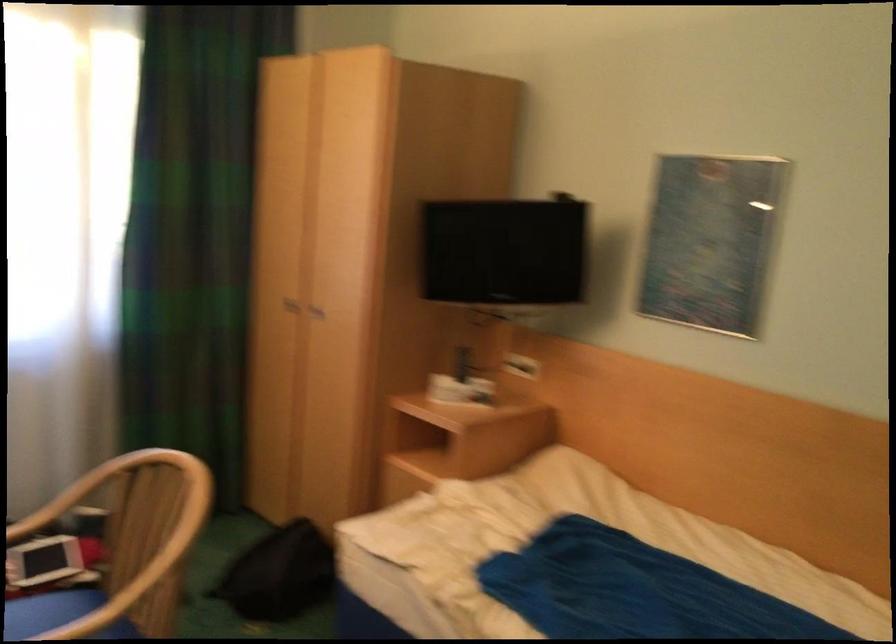
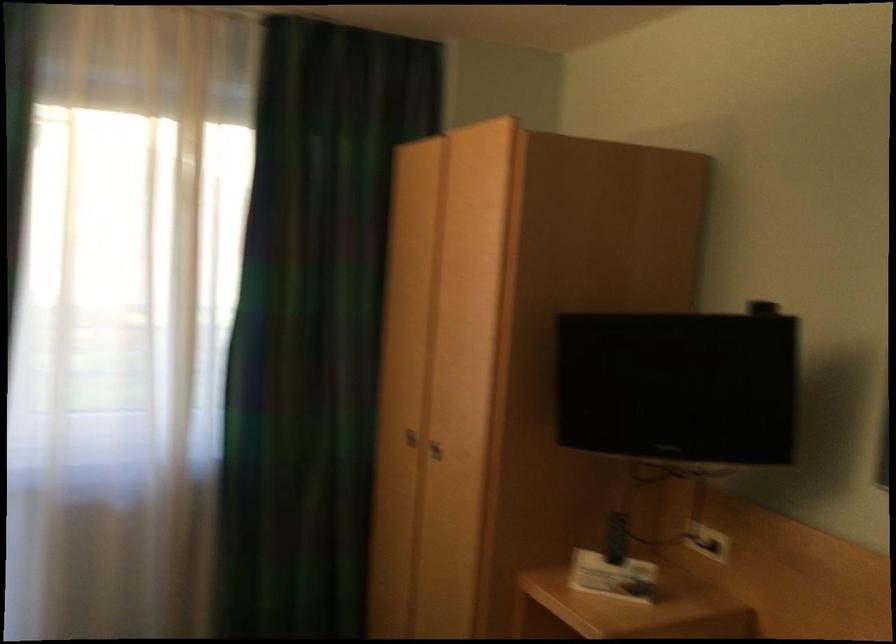
In the second image, find the point that corresponds to (291,305) in the first image.

(409, 438)